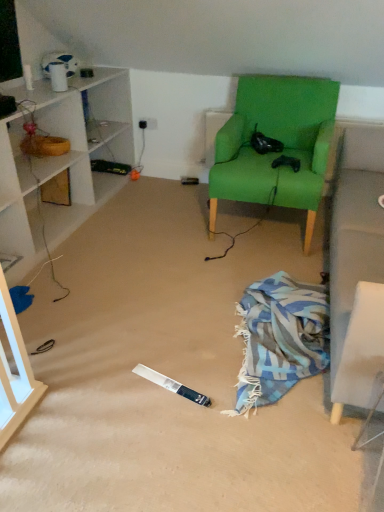
Question: Should I look upward or downward to see blue woven blanket at lower right?

Choices:
 (A) up
 (B) down

Answer: (B)

Question: Can you confirm if green fabric chair at center is shorter than blue woven blanket at lower right?

Choices:
 (A) no
 (B) yes

Answer: (A)

Question: Considering the relative sizes of green fabric chair at center and blue woven blanket at lower right in the image provided, is green fabric chair at center thinner than blue woven blanket at lower right?

Choices:
 (A) no
 (B) yes

Answer: (B)

Question: Is green fabric chair at center outside of blue woven blanket at lower right?

Choices:
 (A) no
 (B) yes

Answer: (B)

Question: Is green fabric chair at center facing away from blue woven blanket at lower right?

Choices:
 (A) no
 (B) yes

Answer: (A)

Question: Is blue woven blanket at lower right surrounded by green fabric chair at center?

Choices:
 (A) yes
 (B) no

Answer: (B)

Question: Does green fabric chair at center turn towards blue woven blanket at lower right?

Choices:
 (A) no
 (B) yes

Answer: (B)

Question: Does blue woven blanket at lower right turn towards green fabric chair at center?

Choices:
 (A) no
 (B) yes

Answer: (A)

Question: Does blue woven blanket at lower right lie in front of green fabric chair at center?

Choices:
 (A) yes
 (B) no

Answer: (A)

Question: Are blue woven blanket at lower right and green fabric chair at center far apart?

Choices:
 (A) no
 (B) yes

Answer: (A)

Question: From a real-world perspective, is blue woven blanket at lower right on top of green fabric chair at center?

Choices:
 (A) yes
 (B) no

Answer: (B)

Question: Considering the relative positions of blue woven blanket at lower right and green fabric chair at center in the image provided, is blue woven blanket at lower right to the left of green fabric chair at center from the viewer's perspective?

Choices:
 (A) no
 (B) yes

Answer: (B)

Question: Does blue woven blanket at lower right come behind green fabric chair at center?

Choices:
 (A) yes
 (B) no

Answer: (B)

Question: Does point (309, 297) appear closer or farther from the camera than point (243, 143)?

Choices:
 (A) farther
 (B) closer

Answer: (B)